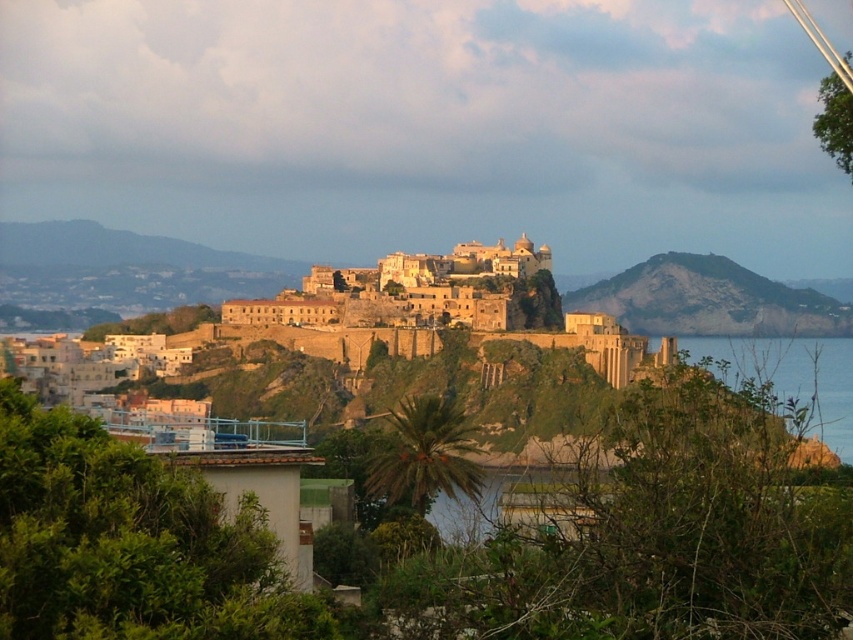
You are standing at the viewpoint in this coastal town and want to know how far the point at coordinates point (229, 317) is from your current position. Can you determine the distance?

The distance between point (229, 317) and the viewer is 1064.42 feet.

From the picture: You are standing at the viewpoint in the coastal town and want to reach the point marked at coordinates point (283, 304). Given that your walking speed is 3 feet per second, how many seconds will it take you to reach that point?

The point (283, 304) is 1059.57 feet away from the camera. At a walking speed of 3 feet per second, it will take approximately 353 seconds to reach that point.

You are standing at the viewpoint in the coastal town and looking towards the sea. There are two points marked in the scene. The first point is at coordinates point (718, 278) and the second is at point (834, 442). Which of these two points is closer to the sea?

Point (834, 442) is closer to the sea because it is in front of point (718, 278), which is behind it according to the spatial description.